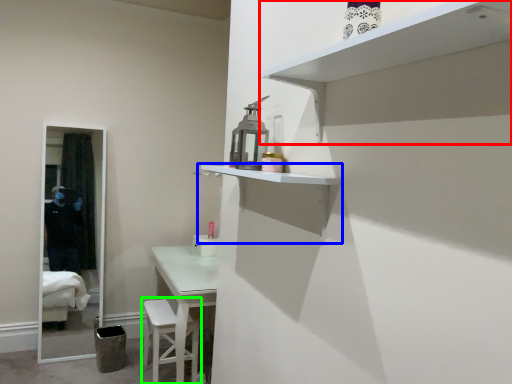
Question: Estimate the real-world distances between objects in this image. Which object is closer to shelf (highlighted by a red box), shelf (highlighted by a blue box) or step stool (highlighted by a green box)?

Choices:
 (A) shelf
 (B) step stool

Answer: (A)